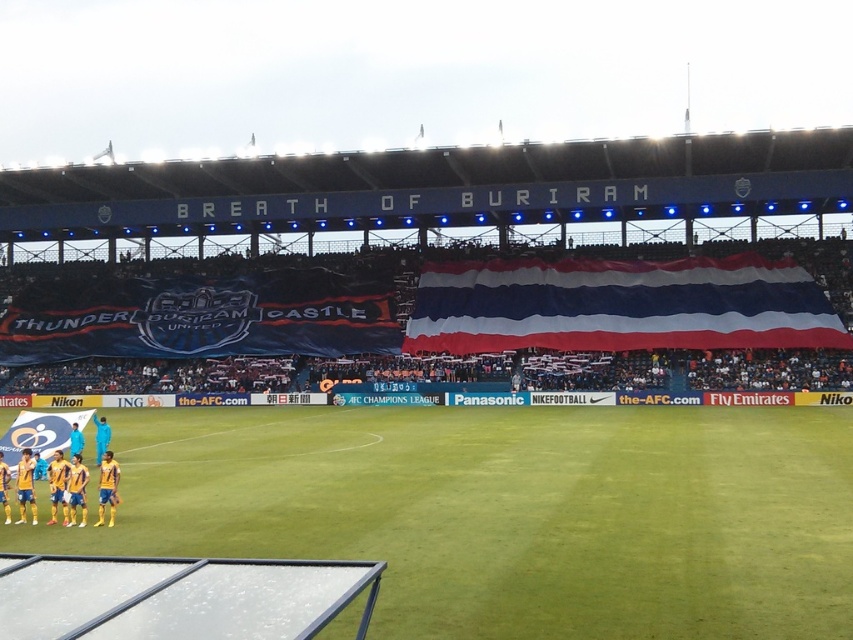
You are a drone operator trying to capture a live shot of the green grass football field at lower center from above. What are the coordinates you should aim for to center the camera on it?

The coordinates to center the camera on the green grass football field at lower center are at point [509,513].